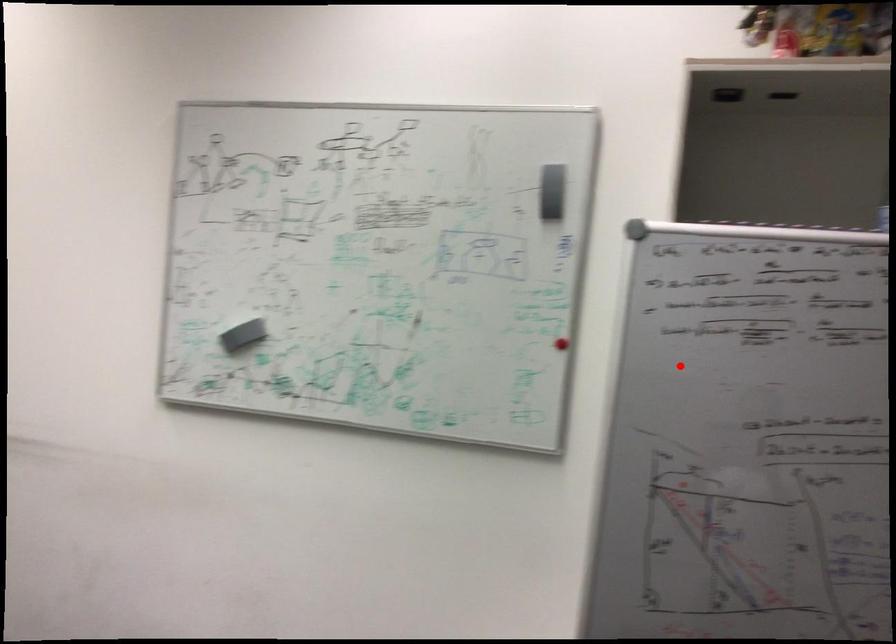
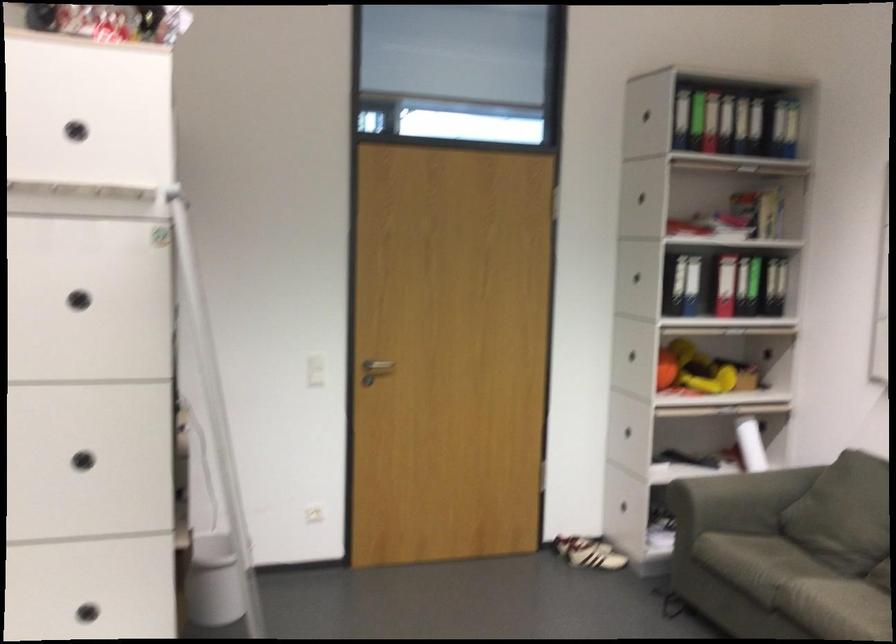
Question: A red point is marked in image1. In image2, is the corresponding 3D point closer to the camera or farther? Reply with the corresponding letter.

Choices:
 (A) The corresponding 3D point is closer.
 (B) The corresponding 3D point is farther.

Answer: (B)